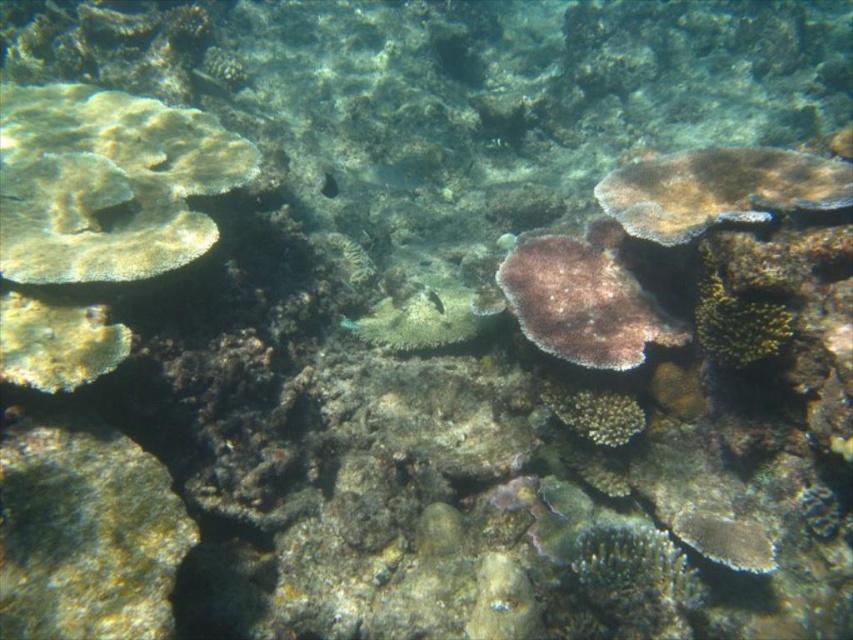
Based on the photo, you are a marine biologist studying the coral reef. You notice a point marked at coordinates (735,320). Based on the scene, what does this point indicate?

The point at coordinates (735,320) marks the location of the green textured coral at center right.

You are a marine biologist studying the coral reef. You have a point marked at coordinates (582, 304). Which coral is this point located on?

The point at (582, 304) is located on the purple matte coral at center.

You are a marine biologist observing an underwater coral reef. You notice two corals at the center of your view. The first is labeled as the purple matte coral at center, and the second is the rough textured coral at center. Based on their positions, which coral would you estimate is closer to the surface?

The purple matte coral at center is taller than the rough textured coral at center. Since taller corals often grow closer to the surface where light is more abundant for symbiotic algae, the purple matte coral at center is likely closer to the surface.